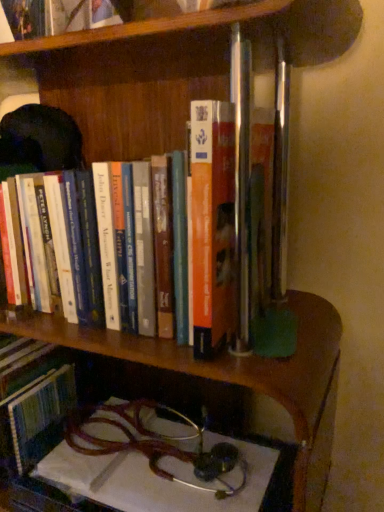
Question: From the image's perspective, does metallic stethoscope at lower center appear lower than hardcover book at center, which is counted as the second book, starting from the top?

Choices:
 (A) no
 (B) yes

Answer: (B)

Question: Is hardcover book at center, the first book when ordered from bottom to top, located within metallic stethoscope at lower center?

Choices:
 (A) no
 (B) yes

Answer: (A)

Question: Can you confirm if metallic stethoscope at lower center is positioned to the right of hardcover book at center, which is counted as the second book, starting from the top?

Choices:
 (A) no
 (B) yes

Answer: (B)

Question: From a real-world perspective, is metallic stethoscope at lower center under hardcover book at center, the first book when ordered from bottom to top?

Choices:
 (A) yes
 (B) no

Answer: (A)

Question: Can you confirm if metallic stethoscope at lower center is shorter than hardcover book at center, which is counted as the second book, starting from the top?

Choices:
 (A) yes
 (B) no

Answer: (A)

Question: Considering the positions of point click(301, 308) and point click(205, 223), is point click(301, 308) closer or farther from the camera than point click(205, 223)?

Choices:
 (A) farther
 (B) closer

Answer: (A)

Question: Is metallic stethoscope at lower center wider or thinner than hardcover book at center, the first book when ordered from bottom to top?

Choices:
 (A) wide
 (B) thin

Answer: (A)

Question: Is metallic stethoscope at lower center in front of or behind hardcover book at center, which is counted as the second book, starting from the top, in the image?

Choices:
 (A) behind
 (B) front

Answer: (A)

Question: From the image's perspective, is metallic stethoscope at lower center located above or below hardcover book at center, which is counted as the second book, starting from the top?

Choices:
 (A) above
 (B) below

Answer: (B)

Question: From a real-world perspective, is metallic stethoscope at lower center positioned above or below hardcover book at upper center, positioned as the 2th book in bottom-to-top order?

Choices:
 (A) above
 (B) below

Answer: (B)

Question: From their relative heights in the image, would you say metallic stethoscope at lower center is taller or shorter than hardcover book at upper center, positioned as the 2th book in bottom-to-top order?

Choices:
 (A) tall
 (B) short

Answer: (A)

Question: From the image's perspective, is metallic stethoscope at lower center located above or below hardcover book at upper center, which is the first book in top-to-bottom order?

Choices:
 (A) above
 (B) below

Answer: (B)

Question: Is metallic stethoscope at lower center wider or thinner than hardcover book at upper center, which is the first book in top-to-bottom order?

Choices:
 (A) thin
 (B) wide

Answer: (B)

Question: From the image's perspective, is hardcover book at upper center, positioned as the 2th book in bottom-to-top order, positioned above or below metallic stethoscope at lower center?

Choices:
 (A) below
 (B) above

Answer: (B)

Question: From a real-world perspective, is hardcover book at upper center, positioned as the 2th book in bottom-to-top order, physically located above or below metallic stethoscope at lower center?

Choices:
 (A) above
 (B) below

Answer: (A)